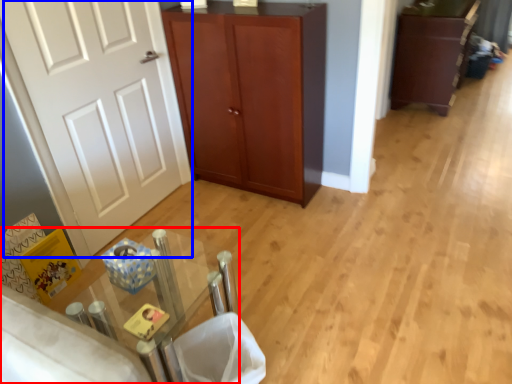
Question: Among these objects, which one is nearest to the camera, table (highlighted by a red box) or door (highlighted by a blue box)?

Choices:
 (A) table
 (B) door

Answer: (A)